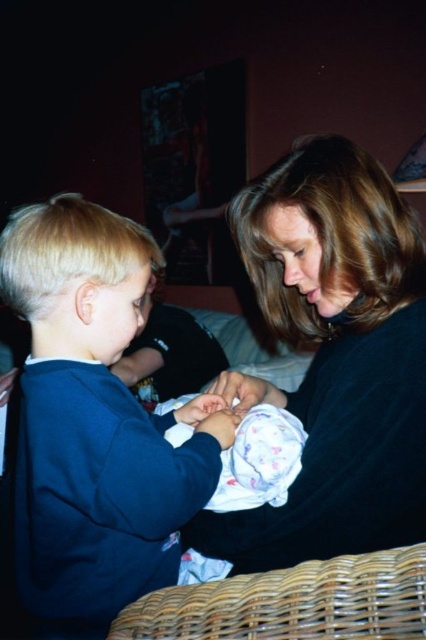
You are standing in the room and want to hand a gift to the person wearing the dark blue sweatshirt at left. The gift is placed at point coordinates of (x=94, y=420). Is the gift already located near the dark blue sweatshirt at left?

Yes, the gift is already located near the dark blue sweatshirt at left because the point coordinates (x=94, y=420) correspond to the dark blue sweatshirt at left.

You are standing in the room and want to place a small gift on the dark blue sweatshirt at left. Where should you aim to place it?

You should aim to place the small gift at point (94,420) where the dark blue sweatshirt at left is located.

You are a photographer setting up a shoot in this room. You want to place a small prop on the fluffy white blanket at center without covering the dark blue sweatshirt at left. Is this possible?

The dark blue sweatshirt at left is located above the fluffy white blanket at center, so placing a prop on the blanket would not interfere with the sweatshirt as long as it stays on the blanket below.